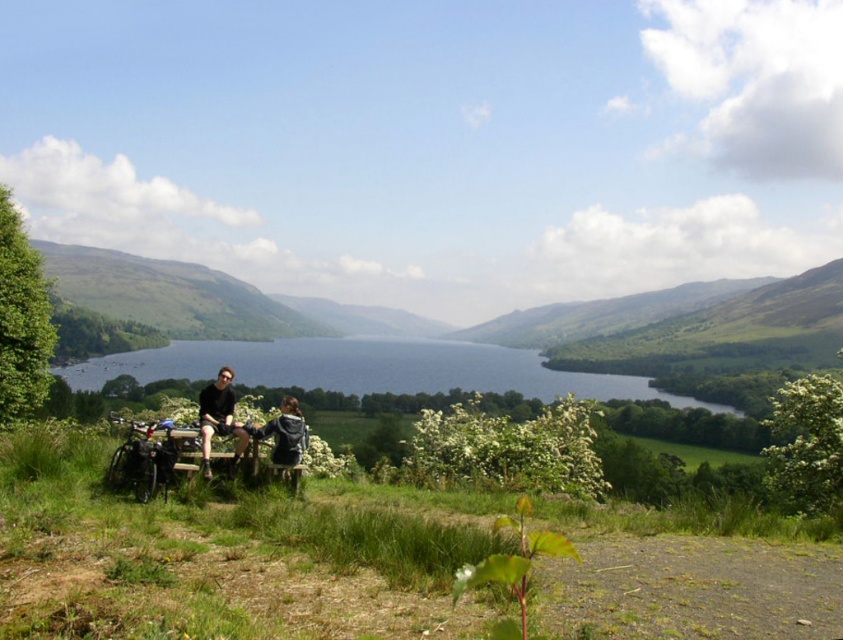
Is dark blue jeans at center shorter than dark gray jacket at lower center?

Incorrect, dark blue jeans at center's height does not fall short of dark gray jacket at lower center's.

Measure the distance from dark blue jeans at center to dark gray jacket at lower center.

They are 19.84 inches apart.

Who is more forward, (x=288, y=413) or (x=272, y=429)?

Positioned in front is point (x=272, y=429).

Where is `dark blue jeans at center`? The image size is (843, 640). dark blue jeans at center is located at coordinates (247, 424).

Is blue water at center closer to the viewer compared to dark gray jacket at lower center?

No.

Can you confirm if blue water at center is wider than dark gray jacket at lower center?

Yes.

Locate an element on the screen. Image resolution: width=843 pixels, height=640 pixels. blue water at center is located at coordinates (369, 369).

This screenshot has height=640, width=843. I want to click on blue water at center, so click(369, 369).

Can you confirm if dark blue jeans at center is bigger than black fabric jacket at lower left?

Correct, dark blue jeans at center is larger in size than black fabric jacket at lower left.

Who is positioned more to the right, dark blue jeans at center or black fabric jacket at lower left?

dark blue jeans at center

Find the location of `dark blue jeans at center`. dark blue jeans at center is located at coordinates (247, 424).

Where is `dark blue jeans at center`? dark blue jeans at center is located at coordinates (247, 424).